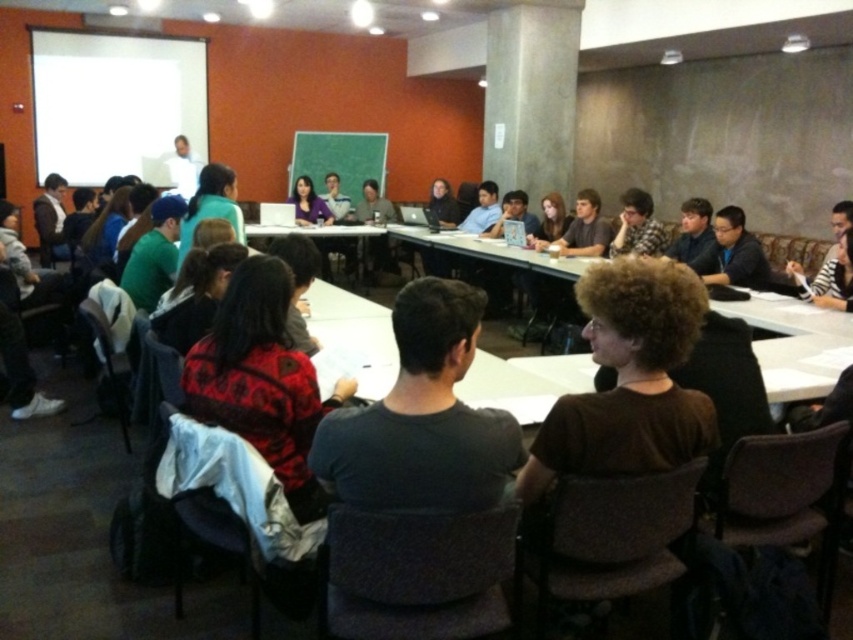
You are organizing a photo shoot in this classroom and need to ensure that the dark gray shirt at center and the brown hair at center are both visible in the frame. Considering their sizes, which object should you focus on to ensure both are in the shot?

The dark gray shirt at center is smaller than the brown hair at center, so focusing on the brown hair at center would help ensure both are visible in the frame.

You are sitting at the back of the classroom and want to ask a question to the person in the dark gray shirt at center. Based on their position, can you estimate whether they are facing towards or away from you?

The dark gray shirt at center is located at point (732,253) which is in the front of the room, so they are facing away from you towards the projection screen.

You are sitting at the back of the classroom and want to ask a question to the presenter. You notice two people in the front row wearing a red sweater at center and a matte black shirt at center. Which person is closer to you?

The matte black shirt at center is closer to you because the red sweater at center is in front of it, meaning the red sweater at center is closer to the presenter and farther from you.